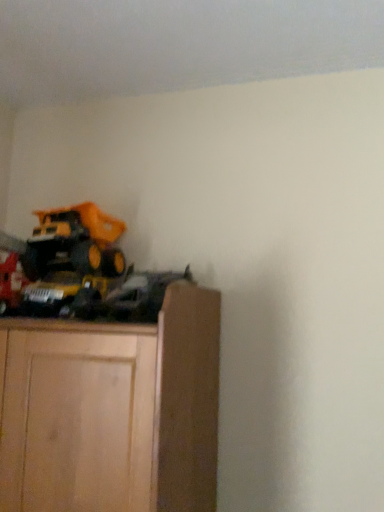
Question: Considering the relative sizes of yellow plastic toy truck at upper left and matte black train at left in the image provided, is yellow plastic toy truck at upper left wider than matte black train at left?

Choices:
 (A) yes
 (B) no

Answer: (A)

Question: From a real-world perspective, is yellow plastic toy truck at upper left physically below matte black train at left?

Choices:
 (A) no
 (B) yes

Answer: (A)

Question: From the image's perspective, is yellow plastic toy truck at upper left over matte black train at left?

Choices:
 (A) no
 (B) yes

Answer: (B)

Question: Is yellow plastic toy truck at upper left smaller than matte black train at left?

Choices:
 (A) no
 (B) yes

Answer: (A)

Question: Could you tell me if yellow plastic toy truck at upper left is turned towards matte black train at left?

Choices:
 (A) no
 (B) yes

Answer: (A)

Question: Would you say yellow plastic toy truck at upper left is a long distance from matte black train at left?

Choices:
 (A) no
 (B) yes

Answer: (A)

Question: Can you confirm if matte black train at left is smaller than yellow plastic toy truck at upper left?

Choices:
 (A) yes
 (B) no

Answer: (A)

Question: Is yellow plastic toy truck at upper left at the back of matte black train at left?

Choices:
 (A) no
 (B) yes

Answer: (A)

Question: From the image's perspective, is matte black train at left beneath yellow plastic toy truck at upper left?

Choices:
 (A) no
 (B) yes

Answer: (B)

Question: Can you confirm if matte black train at left is positioned to the left of yellow plastic toy truck at upper left?

Choices:
 (A) no
 (B) yes

Answer: (B)

Question: Is matte black train at left beside yellow plastic toy truck at upper left?

Choices:
 (A) yes
 (B) no

Answer: (B)

Question: Is matte black train at left located outside yellow plastic toy truck at upper left?

Choices:
 (A) yes
 (B) no

Answer: (A)

Question: From the image's perspective, is yellow plastic toy truck at upper left positioned above or below matte black train at left?

Choices:
 (A) above
 (B) below

Answer: (A)